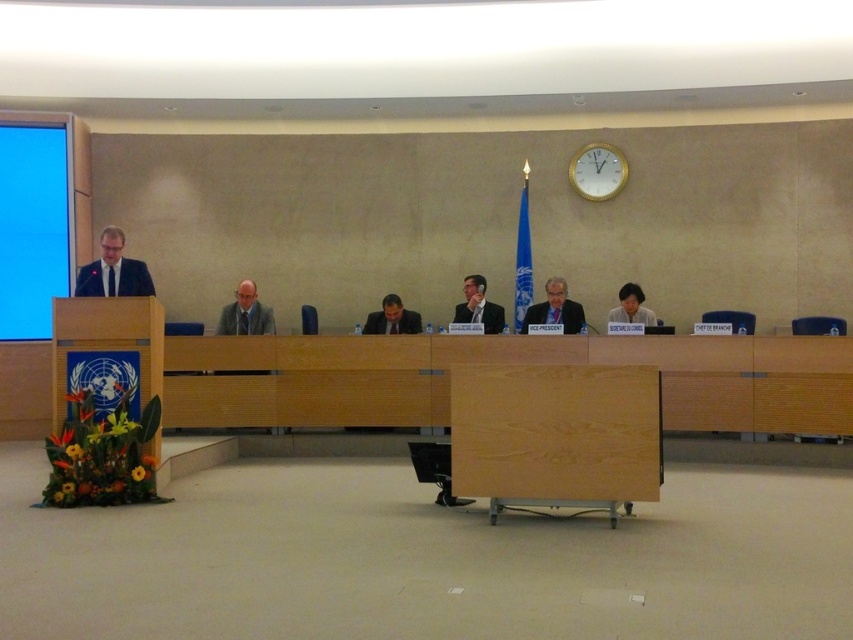
Between point (30, 339) and point (630, 314), which one is positioned in front?

Positioned in front is point (630, 314).

Looking at this image, which is below, blue glossy projection screen at left or matte black laptop at lower right?

Positioned lower is matte black laptop at lower right.

Locate an element on the screen. The width and height of the screenshot is (853, 640). blue glossy projection screen at left is located at coordinates (33, 227).

The height and width of the screenshot is (640, 853). In order to click on blue glossy projection screen at left in this screenshot , I will do `click(33, 227)`.

In the scene shown: Who is positioned more to the right, dark blue suit at center or black suit at center?

Positioned to the right is dark blue suit at center.

From the picture: Does dark blue suit at center have a larger size compared to black suit at center?

Yes.

Locate an element on the screen. dark blue suit at center is located at coordinates [555, 308].

Is point (19, 330) positioned behind point (485, 289)?

No, (19, 330) is in front of (485, 289).

Who is taller, blue glossy projection screen at left or black suit at center?

blue glossy projection screen at left is taller.

This screenshot has width=853, height=640. Describe the element at coordinates (33, 227) in the screenshot. I see `blue glossy projection screen at left` at that location.

The image size is (853, 640). I want to click on blue glossy projection screen at left, so click(x=33, y=227).